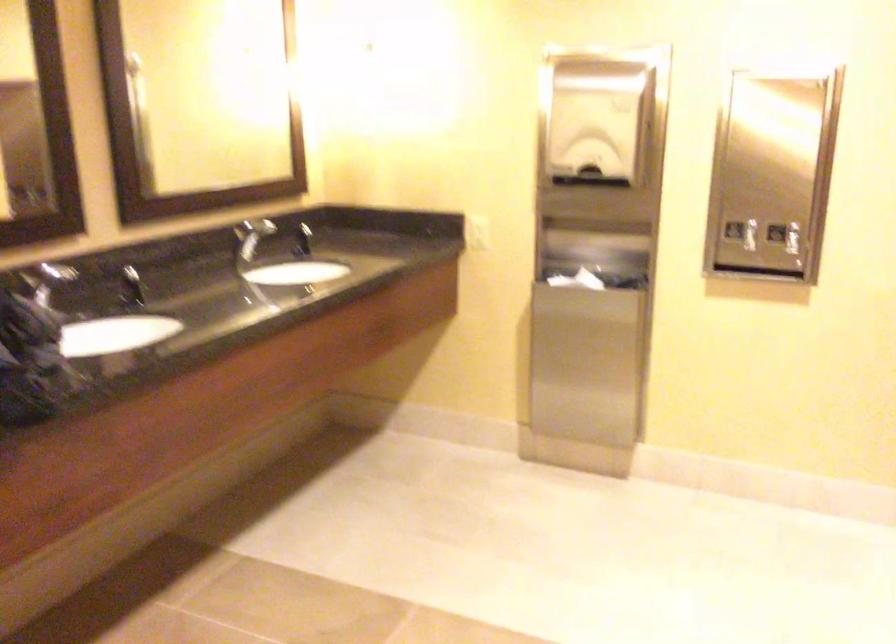
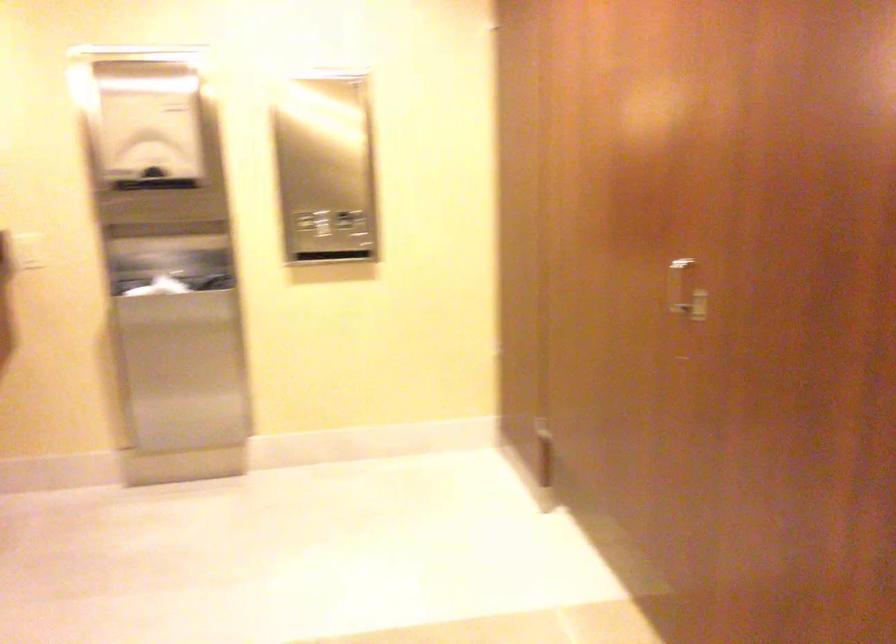
The point at (742,238) is marked in the first image. Where is the corresponding point in the second image?

(317, 229)